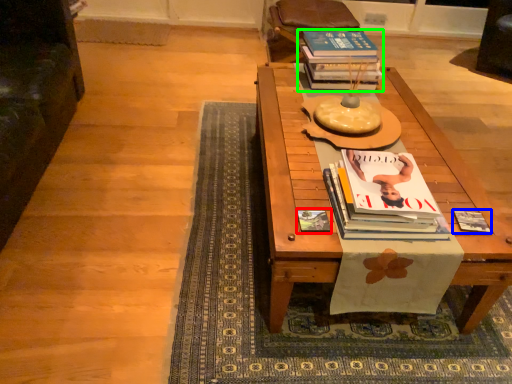
Question: Based on their relative distances, which object is nearer to book cover (highlighted by a red box)? Choose from book (highlighted by a blue box) and book (highlighted by a green box).

Choices:
 (A) book
 (B) book

Answer: (A)